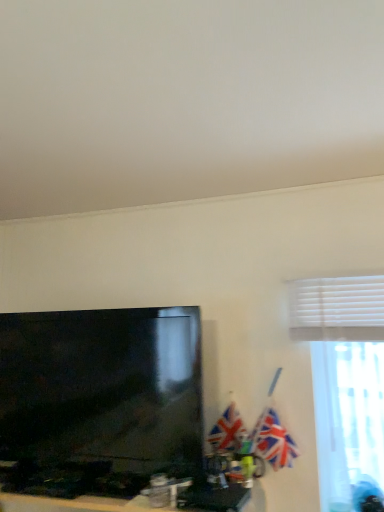
Identify the location of union jack flag at right, marked as the first flag in a right-to-left arrangement. (273, 440).

This screenshot has width=384, height=512. Describe the element at coordinates (227, 430) in the screenshot. I see `textured fabric flag at center, the 2th flag viewed from the right` at that location.

The image size is (384, 512). What do you see at coordinates (69, 485) in the screenshot? I see `matte black tv at lower left` at bounding box center [69, 485].

This screenshot has width=384, height=512. I want to click on matte black tv at left, so pos(99,400).

Is matte black tv at lower left thinner than blue glossy flag pole at upper right?

No, matte black tv at lower left is not thinner than blue glossy flag pole at upper right.

Is matte black tv at lower left aimed at blue glossy flag pole at upper right?

No, matte black tv at lower left is not oriented towards blue glossy flag pole at upper right.

Do you think matte black tv at lower left is within blue glossy flag pole at upper right, or outside of it?

matte black tv at lower left is located beyond the bounds of blue glossy flag pole at upper right.

From a real-world perspective, is matte black tv at lower left positioned above or below blue glossy flag pole at upper right?

matte black tv at lower left is below blue glossy flag pole at upper right.

Are matte black tv at lower left and white blinds at upper right far apart?

No, there isn't a large distance between matte black tv at lower left and white blinds at upper right.

At what (x,y) coordinates should I click in order to perform the action: click on furniture that is below the white blinds at upper right (from the image's perspective). Please return your answer as a coordinate pair (x, y). The image size is (384, 512). Looking at the image, I should click on (69, 485).

From the image's perspective, does matte black tv at lower left appear higher than white blinds at upper right?

Actually, matte black tv at lower left appears below white blinds at upper right in the image.

From a real-world perspective, is matte black tv at lower left above or below white blinds at upper right?

From a real-world perspective, matte black tv at lower left is physically below white blinds at upper right.

Would you say white blinds at upper right is outside matte black tv at lower left?

Indeed, white blinds at upper right is completely outside matte black tv at lower left.

Does point (379, 426) appear closer or farther from the camera than point (34, 485)?

Clearly, point (379, 426) is more distant from the camera than point (34, 485).

Is white blinds at upper right closer to the viewer compared to matte black tv at lower left?

That is False.

Is white blinds at upper right looking in the opposite direction of matte black tv at lower left?

No, white blinds at upper right is not facing away from matte black tv at lower left.

Can you tell me how much blue glossy flag pole at upper right and white blinds at upper right differ in facing direction?

blue glossy flag pole at upper right and white blinds at upper right are facing 1.42 degrees away from each other.

Is blue glossy flag pole at upper right taller than white blinds at upper right?

In fact, blue glossy flag pole at upper right may be shorter than white blinds at upper right.

From the image's perspective, is blue glossy flag pole at upper right located above or below white blinds at upper right?

blue glossy flag pole at upper right is situated lower than white blinds at upper right in the image.

Considering the relative positions of blue glossy flag pole at upper right and white blinds at upper right in the image provided, is blue glossy flag pole at upper right in front of white blinds at upper right?

No, blue glossy flag pole at upper right is further to the viewer.

Considering the positions of objects union jack flag at right, the second flag from the left, and textured fabric flag at center, the 2th flag viewed from the right, in the image provided, who is more to the right, union jack flag at right, the second flag from the left, or textured fabric flag at center, the 2th flag viewed from the right,?

Positioned to the right is union jack flag at right, the second flag from the left.

Is union jack flag at right, marked as the first flag in a right-to-left arrangement, bigger or smaller than textured fabric flag at center, the 2th flag viewed from the right?

Considering their sizes, union jack flag at right, marked as the first flag in a right-to-left arrangement, takes up more space than textured fabric flag at center, the 2th flag viewed from the right.

Considering the sizes of objects union jack flag at right, marked as the first flag in a right-to-left arrangement, and textured fabric flag at center, arranged as the first flag when viewed from the left, in the image provided, who is wider, union jack flag at right, marked as the first flag in a right-to-left arrangement, or textured fabric flag at center, arranged as the first flag when viewed from the left,?

union jack flag at right, marked as the first flag in a right-to-left arrangement, is wider.

Does union jack flag at right, the second flag from the left, come behind textured fabric flag at center, arranged as the first flag when viewed from the left?

No, union jack flag at right, the second flag from the left, is closer to the viewer.

Does point (29, 410) come farther from viewer compared to point (240, 431)?

Yes, point (29, 410) is behind point (240, 431).

Is matte black tv at left touching textured fabric flag at center, arranged as the first flag when viewed from the left?

They are not placed beside each other.

Which of these two, matte black tv at left or textured fabric flag at center, the 2th flag viewed from the right, is bigger?

Bigger between the two is matte black tv at left.

How distant is matte black tv at left from textured fabric flag at center, arranged as the first flag when viewed from the left?

The distance of matte black tv at left from textured fabric flag at center, arranged as the first flag when viewed from the left, is 48.10 centimeters.

Between matte black tv at left and matte black tv at lower left, which one has larger size?

Bigger between the two is matte black tv at lower left.

Is the position of matte black tv at left more distant than that of matte black tv at lower left?

Yes, matte black tv at left is further from the camera.

Consider the image. Can you tell me how much matte black tv at left and matte black tv at lower left differ in facing direction?

They differ by 0.00391 degrees in their facing directions.

Is matte black tv at lower left at the back of matte black tv at left?

No, matte black tv at left is not facing the opposite direction of matte black tv at lower left.

At what (x,y) coordinates should I click in order to perform the action: click on flag pole on the right of matte black tv at lower left. Please return your answer as a coordinate pair (x, y). The width and height of the screenshot is (384, 512). Looking at the image, I should click on (264, 415).

The image size is (384, 512). Identify the location of furniture in front of the white blinds at upper right. (69, 485).

Which object lies further to the anchor point blue glossy flag pole at upper right, matte black tv at left or white blinds at upper right?

matte black tv at left.

From the image, which object appears to be farther from matte black tv at lower left, white blinds at upper right or union jack flag at right, the second flag from the left?

Based on the image, white blinds at upper right appears to be further to matte black tv at lower left.

Which object lies further to the anchor point textured fabric flag at center, the 2th flag viewed from the right, blue glossy flag pole at upper right or matte black tv at left?

Among the two, matte black tv at left is located further to textured fabric flag at center, the 2th flag viewed from the right.

Which object lies further to the anchor point union jack flag at right, marked as the first flag in a right-to-left arrangement, matte black tv at lower left or matte black tv at left?

The object further to union jack flag at right, marked as the first flag in a right-to-left arrangement, is matte black tv at left.

Looking at the image, which one is located further to matte black tv at left, union jack flag at right, the second flag from the left, or white blinds at upper right?

The object further to matte black tv at left is white blinds at upper right.

From the image, which object appears to be nearer to blue glossy flag pole at upper right, white blinds at upper right or textured fabric flag at center, the 2th flag viewed from the right?

textured fabric flag at center, the 2th flag viewed from the right, is positioned closer to the anchor blue glossy flag pole at upper right.

When comparing their distances from matte black tv at left, does union jack flag at right, marked as the first flag in a right-to-left arrangement, or matte black tv at lower left seem closer?

matte black tv at lower left lies closer to matte black tv at left than the other object.

Considering their positions, is textured fabric flag at center, the 2th flag viewed from the right, positioned further to union jack flag at right, the second flag from the left, than matte black tv at lower left?

Based on the image, matte black tv at lower left appears to be further to union jack flag at right, the second flag from the left.

Locate an element on the screen. flag between matte black tv at left and union jack flag at right, the second flag from the left, in the horizontal direction is located at coordinates (227, 430).

The height and width of the screenshot is (512, 384). Identify the location of furniture located between matte black tv at left and textured fabric flag at center, the 2th flag viewed from the right, in the left-right direction. (69, 485).

The image size is (384, 512). Identify the location of flag between matte black tv at lower left and blue glossy flag pole at upper right. (227, 430).

You are a GUI agent. You are given a task and a screenshot of the screen. Output one action in this format:
    pyautogui.click(x=<x>, y=<y>)
    Task: Click on the flag pole situated between textured fabric flag at center, the 2th flag viewed from the right, and union jack flag at right, the second flag from the left, from left to right
    This screenshot has width=384, height=512.
    Given the screenshot: What is the action you would take?
    pyautogui.click(x=264, y=415)